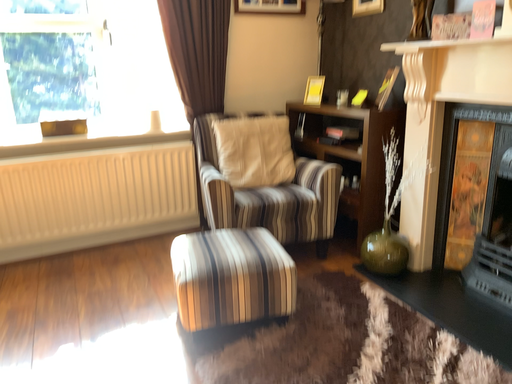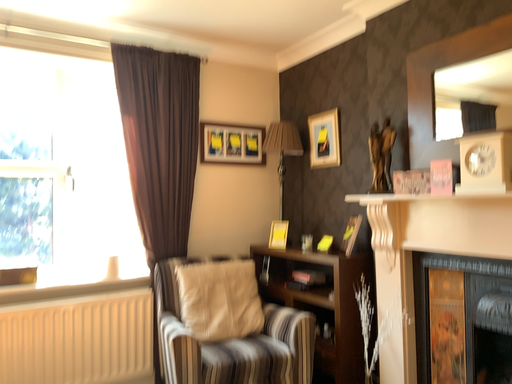
Question: How did the camera likely rotate when shooting the video?

Choices:
 (A) rotated right
 (B) rotated left

Answer: (A)